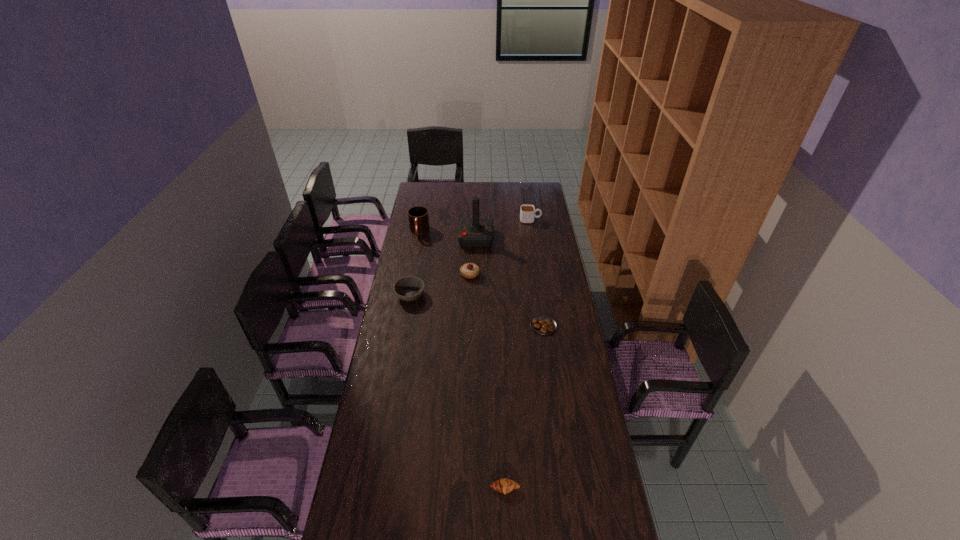
Where is `free space that satisfies the following two spatial constraints: 1. on the side with the handle of the cup; 2. on the side of the sixth shortest object with the handle`? free space that satisfies the following two spatial constraints: 1. on the side with the handle of the cup; 2. on the side of the sixth shortest object with the handle is located at coordinates (532, 232).

The height and width of the screenshot is (540, 960). Find the location of `vacant region that satisfies the following two spatial constraints: 1. on the side of the tallest pastry with the handle; 2. on the right side of the sixth shortest object`. vacant region that satisfies the following two spatial constraints: 1. on the side of the tallest pastry with the handle; 2. on the right side of the sixth shortest object is located at coordinates (411, 274).

Where is `free location that satisfies the following two spatial constraints: 1. on the side of the mug with the handle; 2. on the right side of the bowl`? The width and height of the screenshot is (960, 540). free location that satisfies the following two spatial constraints: 1. on the side of the mug with the handle; 2. on the right side of the bowl is located at coordinates (408, 295).